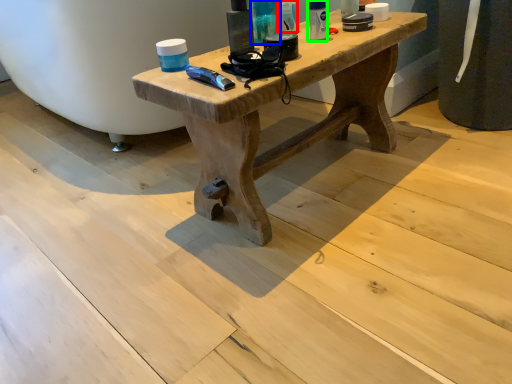
Question: Which object is positioned farthest from toiletry (highlighted by a red box)? Select from toiletry (highlighted by a blue box) and toiletry (highlighted by a green box).

Choices:
 (A) toiletry
 (B) toiletry

Answer: (B)